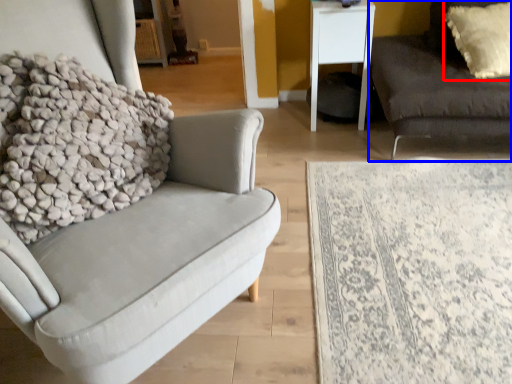
Question: Which point is further to the camera, pillow (highlighted by a red box) or studio couch (highlighted by a blue box)?

Choices:
 (A) pillow
 (B) studio couch

Answer: (A)